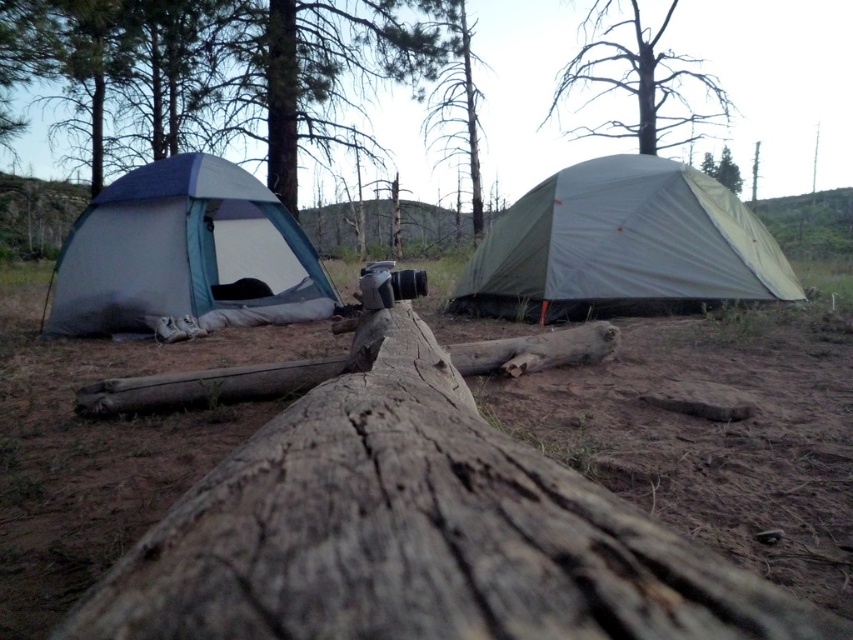
Can you confirm if smooth bark tree at left is positioned to the left of brown bark tree at upper center?

Correct, you'll find smooth bark tree at left to the left of brown bark tree at upper center.

Which of these two, smooth bark tree at left or brown bark tree at upper center, stands taller?

With more height is smooth bark tree at left.

You are a GUI agent. You are given a task and a screenshot of the screen. Output one action in this format:
    pyautogui.click(x=<x>, y=<y>)
    Task: Click on the smooth bark tree at left
    This screenshot has width=853, height=640.
    Given the screenshot: What is the action you would take?
    pyautogui.click(x=228, y=74)

Does rough textured log at center appear on the right side of smooth bark tree at left?

Yes, rough textured log at center is to the right of smooth bark tree at left.

Does point (381, 497) come farther from viewer compared to point (184, 129)?

No, it is in front of (184, 129).

What do you see at coordinates (415, 532) in the screenshot? I see `rough textured log at center` at bounding box center [415, 532].

In order to click on rough textured log at center in this screenshot , I will do `click(415, 532)`.

Consider the image. Does rough textured log at center have a lesser height compared to green fabric tent at center?

Yes, rough textured log at center is shorter than green fabric tent at center.

Is rough textured log at center below green fabric tent at center?

Yes.

Who is more forward, [395,621] or [753,230]?

Point [395,621]

The width and height of the screenshot is (853, 640). What are the coordinates of `rough textured log at center` in the screenshot? It's located at (415, 532).